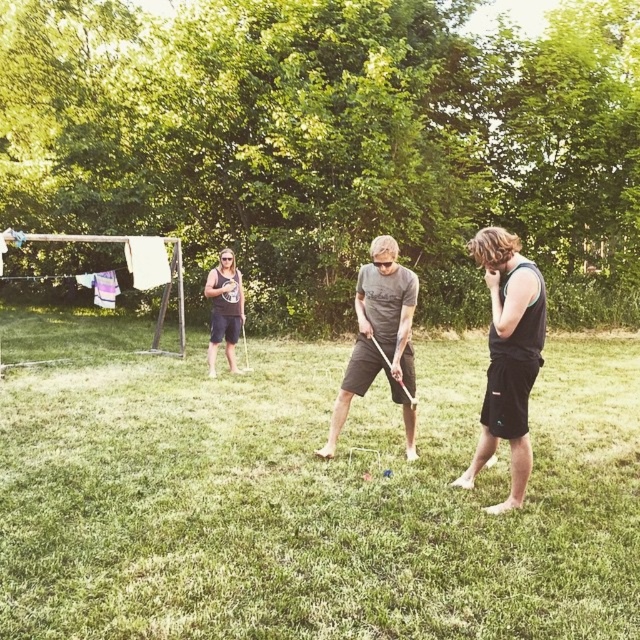
You are standing in the backyard and want to place a small flag exactly halfway between point (x=224, y=288) and point (x=108, y=291). Will the flag be closer to the camera than both points?

The flag placed halfway between point (x=224, y=288) and point (x=108, y=291) will be closer to the camera than point (x=108, y=291) but not closer than point (x=224, y=288) since the latter is already closer to the camera than the former.

You are trying to decide which of the two people to approach for a game. The matte black tank top at center and the white cotton shirt at left are both holding croquet mallets. Which person is closer to you based on their clothing size?

The matte black tank top at center is larger in size than the white cotton shirt at left, so the matte black tank top at center is closer to you.